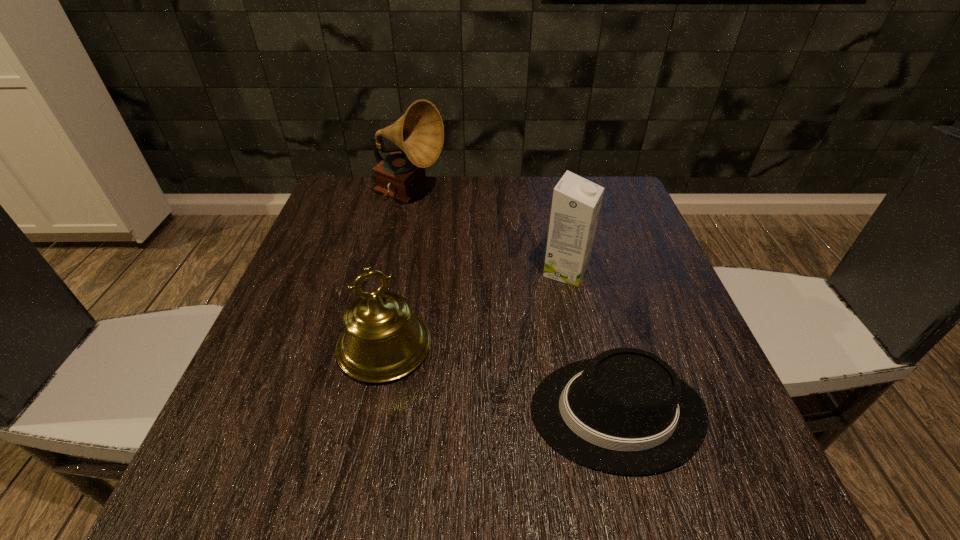
The image size is (960, 540). Find the location of `vacant space located 0.070m on the front-facing side of the fedora`. vacant space located 0.070m on the front-facing side of the fedora is located at coordinates (487, 412).

The image size is (960, 540). I want to click on object located at the far edge, so click(419, 133).

This screenshot has width=960, height=540. I want to click on object present at the near edge, so click(x=625, y=411).

Where is `phonograph record that is at the left edge`? The image size is (960, 540). phonograph record that is at the left edge is located at coordinates (419, 133).

Locate an element on the screen. The image size is (960, 540). bell at the left edge is located at coordinates (383, 341).

The image size is (960, 540). What are the coordinates of `object at the right edge` in the screenshot? It's located at (625, 411).

The image size is (960, 540). I want to click on object situated at the far left corner, so click(x=419, y=133).

You are a GUI agent. You are given a task and a screenshot of the screen. Output one action in this format:
    pyautogui.click(x=<x>, y=<y>)
    Task: Click on the object at the near right corner
    The width and height of the screenshot is (960, 540).
    Given the screenshot: What is the action you would take?
    pyautogui.click(x=625, y=411)

This screenshot has width=960, height=540. I want to click on vacant point at the far edge, so click(419, 208).

Locate an element on the screen. vacant space at the left edge of the desktop is located at coordinates (303, 277).